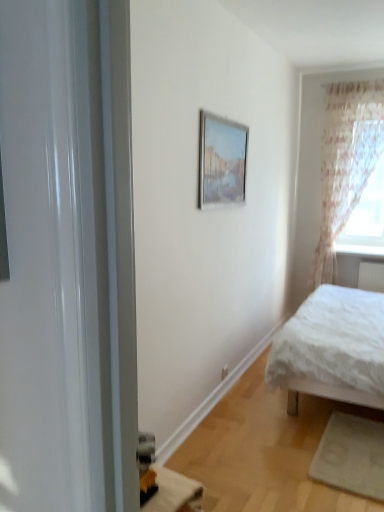
In order to face sheer floral fabric at right, should I rotate leftwards or rightwards?

To face it directly, rotate right by 20.552 degrees.

What is the approximate height of sheer floral fabric at right?

sheer floral fabric at right is 7.36 feet in height.

At what (x,y) coordinates should I click in order to perform the action: click on matte silver picture frame at upper center. Please return your answer as a coordinate pair (x, y). Looking at the image, I should click on (222, 160).

The image size is (384, 512). In order to click on sheer floral fabric at right in this screenshot , I will do `click(346, 162)`.

Is translucent floral curtain at right not inside white glossy window sill at upper right?

Yes, translucent floral curtain at right is outside of white glossy window sill at upper right.

Visually, is translucent floral curtain at right positioned to the left or to the right of white glossy window sill at upper right?

Clearly, translucent floral curtain at right is on the right of white glossy window sill at upper right in the image.

Which is nearer, (380, 145) or (344, 252)?

The point (380, 145) is in front.

From the image's perspective, is translucent floral curtain at right under white glossy window sill at upper right?

Actually, translucent floral curtain at right appears above white glossy window sill at upper right in the image.

The image size is (384, 512). I want to click on picture frame on the left side of sheer floral fabric at right, so click(222, 160).

From the image's perspective, is sheer floral fabric at right positioned above or below matte silver picture frame at upper center?

sheer floral fabric at right is situated lower than matte silver picture frame at upper center in the image.

How different are the orientations of sheer floral fabric at right and matte silver picture frame at upper center in degrees?

The angular difference between sheer floral fabric at right and matte silver picture frame at upper center is 89.2 degrees.

Considering the points (342, 197) and (207, 194), which point is behind, point (342, 197) or point (207, 194)?

Point (342, 197)

Is white glossy window sill at upper right far away from white textured bed at right?

Yes.

From a real-world perspective, relative to white textured bed at right, is white glossy window sill at upper right vertically above or below?

white glossy window sill at upper right is above white textured bed at right.

Considering the sizes of objects white glossy window sill at upper right and white textured bed at right in the image provided, who is smaller, white glossy window sill at upper right or white textured bed at right?

white glossy window sill at upper right is smaller.

In the scene shown: From their relative heights in the image, would you say white glossy window sill at upper right is taller or shorter than white textured bed at right?

Clearly, white glossy window sill at upper right is shorter compared to white textured bed at right.

Is matte silver picture frame at upper center not inside white textured bed at right?

matte silver picture frame at upper center lies outside white textured bed at right's area.

Looking at this image, can you confirm if matte silver picture frame at upper center is wider than white textured bed at right?

No, matte silver picture frame at upper center is not wider than white textured bed at right.

Is matte silver picture frame at upper center far away from white textured bed at right?

Indeed, matte silver picture frame at upper center is not near white textured bed at right.

Find the location of a particular element. The image size is (384, 512). bed located on the right of matte silver picture frame at upper center is located at coordinates (332, 348).

Would you say white textured bed at right is part of sheer floral fabric at right's contents?

No, white textured bed at right is located outside of sheer floral fabric at right.

Who is more distant, sheer floral fabric at right or white textured bed at right?

sheer floral fabric at right is more distant.

Locate an element on the screen. This screenshot has width=384, height=512. bed below the sheer floral fabric at right (from a real-world perspective) is located at coordinates (332, 348).

Is sheer floral fabric at right oriented towards white textured bed at right?

Yes.

Identify the location of bed in front of the white glossy window sill at upper right. (332, 348).

Do you think white textured bed at right is within white glossy window sill at upper right, or outside of it?

white textured bed at right is located beyond the bounds of white glossy window sill at upper right.

Is point (335, 333) positioned behind point (348, 245)?

That is False.

Is white glossy window sill at upper right located outside translucent floral curtain at right?

Absolutely, white glossy window sill at upper right is external to translucent floral curtain at right.

In terms of width, does white glossy window sill at upper right look wider or thinner when compared to translucent floral curtain at right?

Considering their sizes, white glossy window sill at upper right looks broader than translucent floral curtain at right.

Is white glossy window sill at upper right oriented towards translucent floral curtain at right?

No, white glossy window sill at upper right does not turn towards translucent floral curtain at right.

Identify the location of window lying on the right of white glossy window sill at upper right. (367, 204).

Where is `curtain behind the matte silver picture frame at upper center`? This screenshot has height=512, width=384. curtain behind the matte silver picture frame at upper center is located at coordinates (346, 162).

Based on their spatial positions, is white glossy window sill at upper right or sheer floral fabric at right further from translucent floral curtain at right?

white glossy window sill at upper right is positioned further to the anchor translucent floral curtain at right.

From the image, which object appears to be farther from white textured bed at right, sheer floral fabric at right or translucent floral curtain at right?

Based on the image, sheer floral fabric at right appears to be further to white textured bed at right.

Estimate the real-world distances between objects in this image. Which object is closer to sheer floral fabric at right, matte silver picture frame at upper center or translucent floral curtain at right?

Based on the image, translucent floral curtain at right appears to be nearer to sheer floral fabric at right.

When comparing their distances from white textured bed at right, does matte silver picture frame at upper center or translucent floral curtain at right seem closer?

matte silver picture frame at upper center is positioned closer to the anchor white textured bed at right.

From the image, which object appears to be farther from white glossy window sill at upper right, translucent floral curtain at right or matte silver picture frame at upper center?

A: matte silver picture frame at upper center is further to white glossy window sill at upper right.

Considering their positions, is matte silver picture frame at upper center positioned closer to white textured bed at right than white glossy window sill at upper right?

Among the two, matte silver picture frame at upper center is located nearer to white textured bed at right.

Estimate the real-world distances between objects in this image. Which object is closer to matte silver picture frame at upper center, white glossy window sill at upper right or translucent floral curtain at right?

The object closer to matte silver picture frame at upper center is translucent floral curtain at right.

Which object lies nearer to the anchor point translucent floral curtain at right, sheer floral fabric at right or white textured bed at right?

Based on the image, sheer floral fabric at right appears to be nearer to translucent floral curtain at right.

Where is `window sill between white textured bed at right and translucent floral curtain at right in the front-back direction`? window sill between white textured bed at right and translucent floral curtain at right in the front-back direction is located at coordinates (360, 250).

At what (x,y) coordinates should I click in order to perform the action: click on window sill located between matte silver picture frame at upper center and translucent floral curtain at right in the depth direction. Please return your answer as a coordinate pair (x, y). This screenshot has width=384, height=512. Looking at the image, I should click on (360, 250).

This screenshot has height=512, width=384. In order to click on curtain between matte silver picture frame at upper center and white glossy window sill at upper right in the front-back direction in this screenshot , I will do `click(346, 162)`.

You are a GUI agent. You are given a task and a screenshot of the screen. Output one action in this format:
    pyautogui.click(x=<x>, y=<y>)
    Task: Click on the curtain between white textured bed at right and translucent floral curtain at right in the front-back direction
    The height and width of the screenshot is (512, 384).
    Given the screenshot: What is the action you would take?
    pyautogui.click(x=346, y=162)